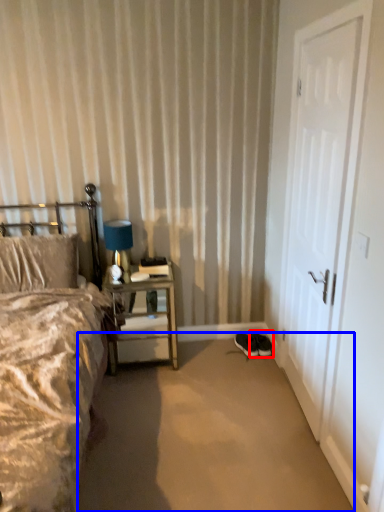
Question: Which object is closer to the camera taking this photo, footwear (highlighted by a red box) or plain (highlighted by a blue box)?

Choices:
 (A) footwear
 (B) plain

Answer: (B)